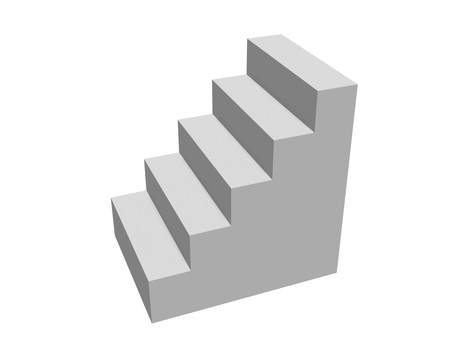
Locate an element on the screen. The width and height of the screenshot is (453, 340). individual steps on stairs is located at coordinates (147, 241), (188, 196), (225, 155), (261, 111), (305, 62).